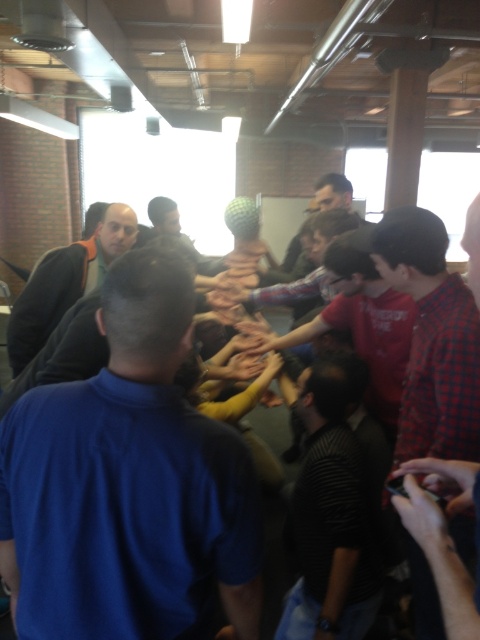
You are standing in the office and want to place a small plant pot exactly at point [283,636]. The plant pot requires a minimum of 1.8 meters of space from the camera to avoid blocking the view. Can you safely place the plant pot there?

The distance of point [283,636] from camera is 1.90 meters, which is greater than the required 1.8 meters, so you can safely place the plant pot there without blocking the view.

You are a photographer standing at the edge of the group. You want to take a photo of the dark striped shirt at center and the camouflage fabric shirt at center without any obstruction. Given that your camera has a minimum focus distance of 1.5 meters, will you be able to capture both subjects clearly in the frame?

The dark striped shirt at center is 1.65 meters away from the camouflage fabric shirt at center. Since the minimum focus distance is 1.5 meters, the photographer can capture both subjects clearly as they are within the required distance.

You are standing in the middle of the room and want to move to the dark striped shirt at center. Which direction should you move to reach it?

The dark striped shirt at center is located at point 0.802 on the x axis and 0.692 on the y axis. Since you are in the middle of the room, you should move towards the right and forward to reach it.